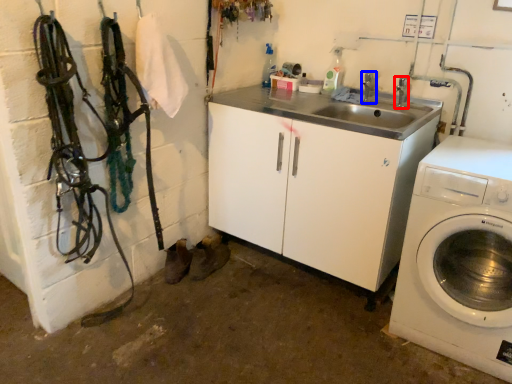
Question: Which object is further to the camera taking this photo, faucet (highlighted by a red box) or faucet (highlighted by a blue box)?

Choices:
 (A) faucet
 (B) faucet

Answer: (B)